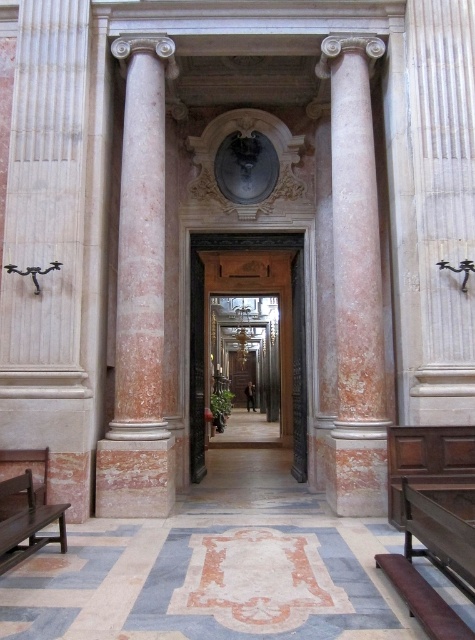
You are an art conservator standing in the grand classical space. You need to examine two points marked in the scene. The first point is at coordinates point (148,90) and the second is at point (468,589). Which point is closer to you?

Point (148,90) is closer to you because it is further to the viewer than point (468,589).

You are a visitor standing at the entrance of the grand space. You see the pink marble column at center and the wooden bench at lower left. Which object is closer to you?

The pink marble column at center is closer to you than the wooden bench at lower left, so the pink marble column at center is closer.